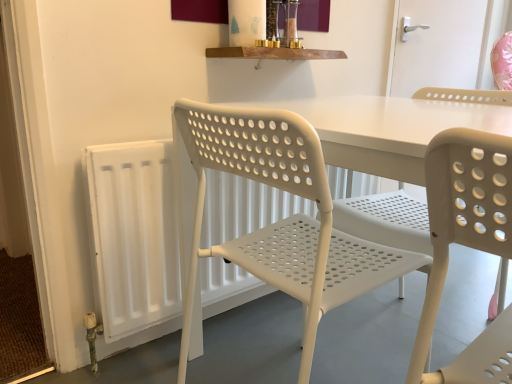
Question: Is white plastic door handle at upper right a part of white plastic radiator at left?

Choices:
 (A) yes
 (B) no

Answer: (B)

Question: Is white plastic radiator at left further to camera compared to white plastic door handle at upper right?

Choices:
 (A) yes
 (B) no

Answer: (B)

Question: From a real-world perspective, is white plastic radiator at left beneath white plastic door handle at upper right?

Choices:
 (A) yes
 (B) no

Answer: (A)

Question: Is the depth of white plastic radiator at left less than that of white plastic door handle at upper right?

Choices:
 (A) no
 (B) yes

Answer: (B)

Question: Can you confirm if white plastic radiator at left is positioned to the right of white plastic door handle at upper right?

Choices:
 (A) yes
 (B) no

Answer: (B)

Question: Does white plastic radiator at left have a greater height compared to white plastic door handle at upper right?

Choices:
 (A) no
 (B) yes

Answer: (B)

Question: From a real-world perspective, is white plastic door handle at upper right below white plastic radiator at left?

Choices:
 (A) yes
 (B) no

Answer: (B)

Question: Is white plastic door handle at upper right located outside white plastic radiator at left?

Choices:
 (A) yes
 (B) no

Answer: (A)

Question: Does white plastic door handle at upper right have a larger size compared to white plastic radiator at left?

Choices:
 (A) yes
 (B) no

Answer: (B)

Question: Is white plastic door handle at upper right further to camera compared to white plastic radiator at left?

Choices:
 (A) yes
 (B) no

Answer: (A)

Question: Can you confirm if white plastic door handle at upper right is taller than white plastic radiator at left?

Choices:
 (A) yes
 (B) no

Answer: (B)

Question: Considering the relative sizes of white plastic door handle at upper right and white plastic radiator at left in the image provided, is white plastic door handle at upper right smaller than white plastic radiator at left?

Choices:
 (A) yes
 (B) no

Answer: (A)

Question: Considering the relative sizes of white plastic chair at left and white plastic door handle at upper right in the image provided, is white plastic chair at left shorter than white plastic door handle at upper right?

Choices:
 (A) yes
 (B) no

Answer: (B)